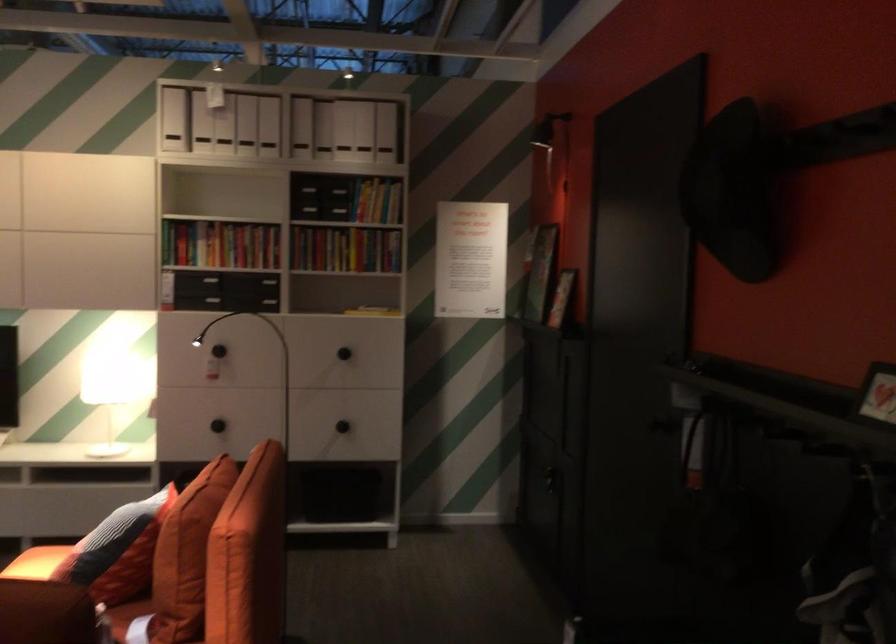
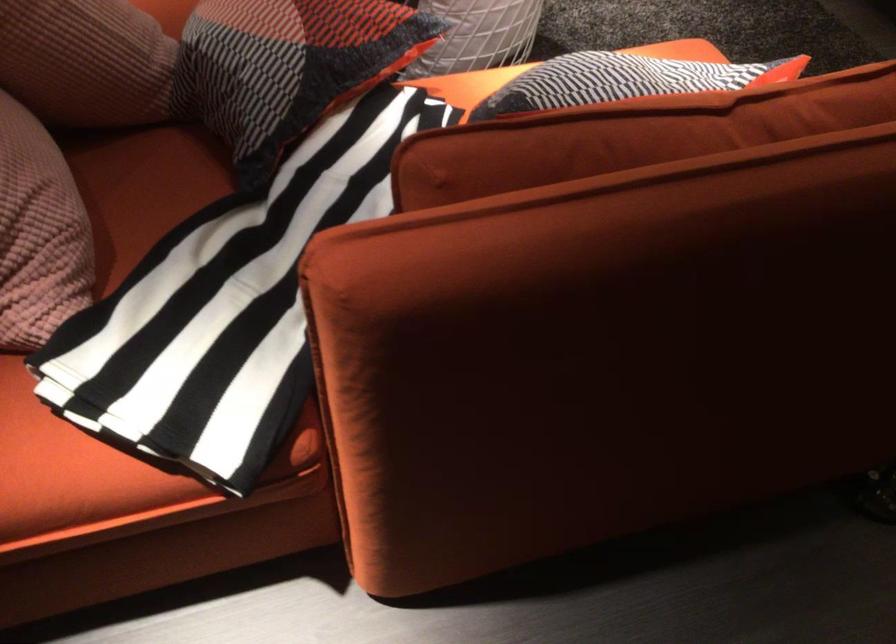
Question: I am providing you with two images of the same scene from different viewpoints. Which of the following objects are not visible in image2?

Choices:
 (A) red shoe
 (B) plaid pillow
 (C) white wire basket
 (D) orange throw pillow

Answer: (D)